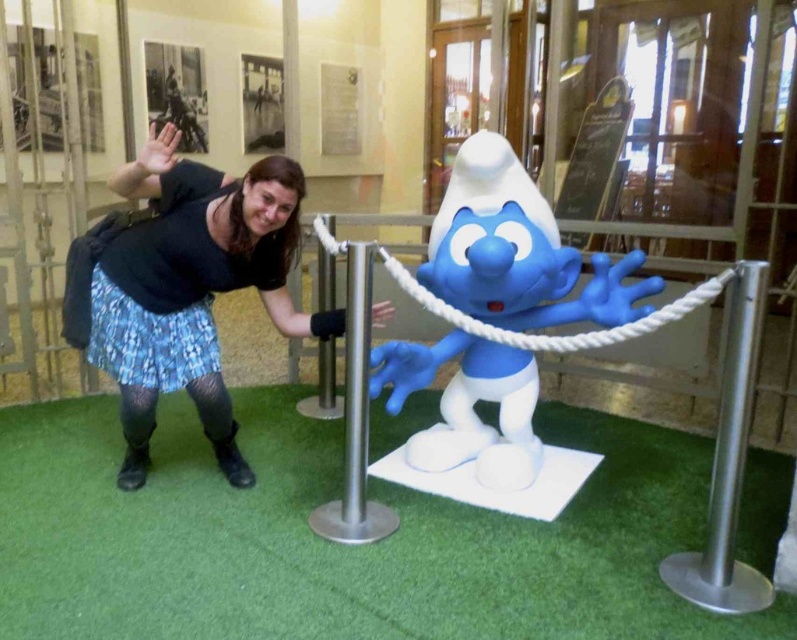
Based on the photo, which is below, black fabric skirt at center or silver metallic pole at center?

silver metallic pole at center is lower down.

Between black fabric skirt at center and silver metallic pole at center, which one appears on the right side from the viewer's perspective?

silver metallic pole at center

Does point (234, 472) come farther from viewer compared to point (356, 394)?

That is True.

Locate an element on the screen. The height and width of the screenshot is (640, 797). black fabric skirt at center is located at coordinates (191, 289).

Who is positioned more to the left, black fabric skirt at center or blue plastic smurf at center?

Positioned to the left is black fabric skirt at center.

Is black fabric skirt at center further to camera compared to blue plastic smurf at center?

No.

Which is in front, point (187, 355) or point (453, 346)?

Positioned in front is point (187, 355).

Find the location of a particular element. Image resolution: width=797 pixels, height=640 pixels. black fabric skirt at center is located at coordinates (191, 289).

Is blue plastic smurf at center wider than silver metallic pole at center?

Yes.

Is blue plastic smurf at center shorter than silver metallic pole at center?

In fact, blue plastic smurf at center may be taller than silver metallic pole at center.

Between point (563, 321) and point (360, 312), which one is positioned in front?

Point (360, 312)

Where is `blue plastic smurf at center`? The image size is (797, 640). blue plastic smurf at center is located at coordinates (517, 250).